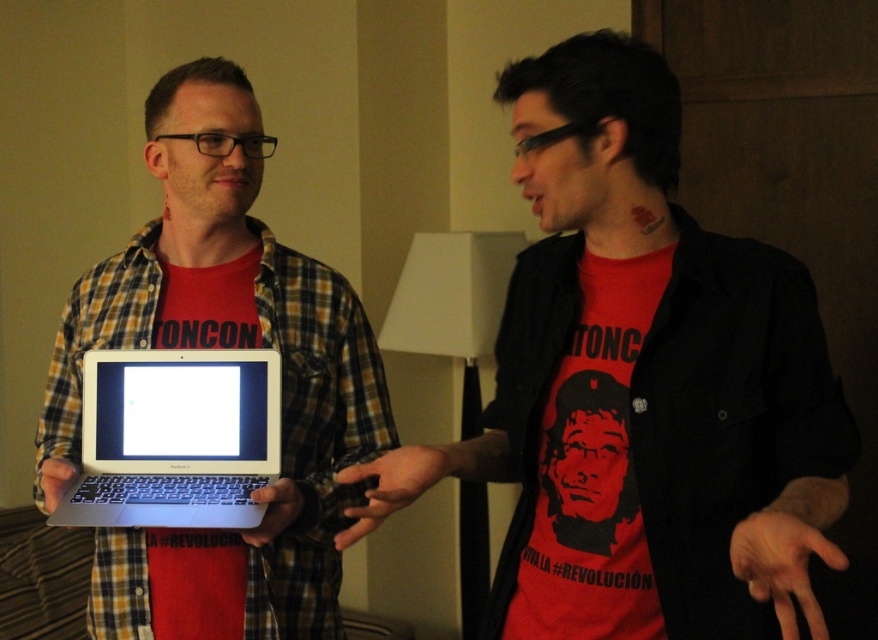
You are a photographer setting up for a group photo. You need to position the matte black shirt at center and the silver metallic laptop at center so that they are aligned properly. Based on the scene, which object should be placed to the left to create symmetry?

The silver metallic laptop at center should be placed to the left of the matte black shirt at center to create symmetry since the matte black shirt at center is currently to the right of the silver metallic laptop at center.

What is located at the coordinate point (645,392) in the image?

The matte black shirt at center is located at the coordinate point (645,392).

You are standing in the room where the two people are talking. You want to hand a document to the person wearing the matte black shirt at center without moving your feet. Can you reach them?

The matte black shirt at center is 30.49 inches away from the viewer, so yes, you can reach them without moving your feet since the average human arm length is about 25 to 30 inches.